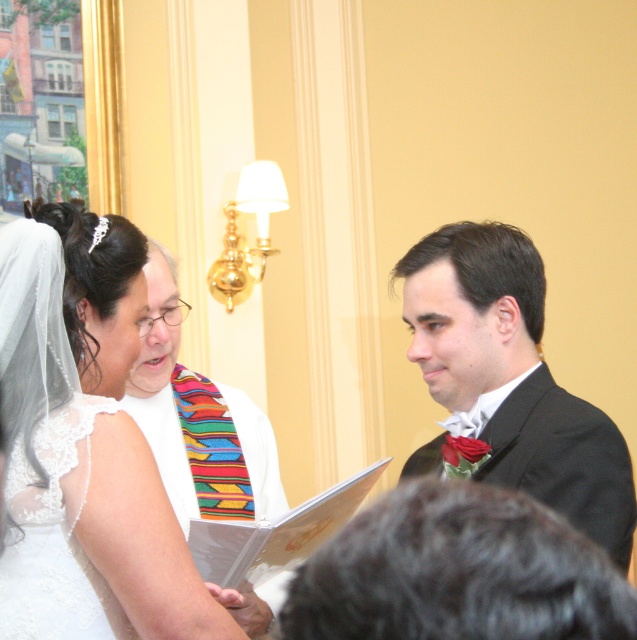
Does matte black suit at center appear over white lace wedding dress at lower left?

Correct, matte black suit at center is located above white lace wedding dress at lower left.

Which is more to the left, matte black suit at center or white lace wedding dress at lower left?

white lace wedding dress at lower left is more to the left.

Identify the location of matte black suit at center. (513, 376).

Does black satin suit at center appear under matte black suit at center?

Yes, black satin suit at center is below matte black suit at center.

Between black satin suit at center and matte black suit at center, which one appears on the left side from the viewer's perspective?

Positioned to the left is black satin suit at center.

Is point (533, 525) farther from viewer compared to point (575, 460)?

No, (533, 525) is closer to viewer.

The width and height of the screenshot is (637, 640). What are the coordinates of `black satin suit at center` in the screenshot? It's located at (457, 572).

This screenshot has height=640, width=637. Describe the element at coordinates (89, 428) in the screenshot. I see `white satin dress at center` at that location.

Between white satin dress at center and black satin suit at center, which one appears on the left side from the viewer's perspective?

From the viewer's perspective, white satin dress at center appears more on the left side.

What do you see at coordinates (89, 428) in the screenshot?
I see `white satin dress at center` at bounding box center [89, 428].

At what (x,y) coordinates should I click in order to perform the action: click on white satin dress at center. Please return your answer as a coordinate pair (x, y). Looking at the image, I should click on (89, 428).